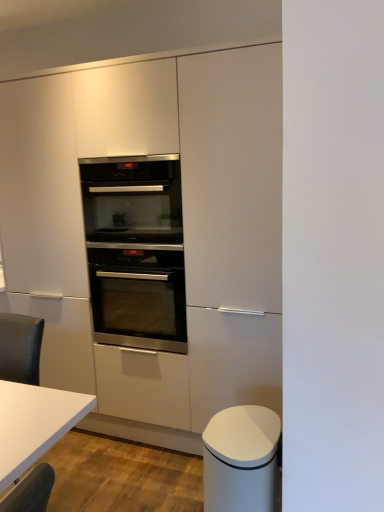
Question: Does white matte trash can at lower right, marked as the 2th cabinetry in a back-to-front arrangement, appear on the left side of stainless steel oven at center, which ranks as the second oven in bottom-to-top order?

Choices:
 (A) yes
 (B) no

Answer: (B)

Question: Does white matte trash can at lower right, marked as the 2th cabinetry in a back-to-front arrangement, come in front of stainless steel oven at center, which ranks as the second oven in bottom-to-top order?

Choices:
 (A) no
 (B) yes

Answer: (B)

Question: Is white matte trash can at lower right, the first cabinetry from the front, oriented towards stainless steel oven at center, which ranks as the second oven in bottom-to-top order?

Choices:
 (A) yes
 (B) no

Answer: (B)

Question: Considering the relative sizes of white matte trash can at lower right, marked as the 2th cabinetry in a back-to-front arrangement, and stainless steel oven at center, which appears as the first oven when viewed from the top, in the image provided, is white matte trash can at lower right, marked as the 2th cabinetry in a back-to-front arrangement, taller than stainless steel oven at center, which appears as the first oven when viewed from the top,?

Choices:
 (A) no
 (B) yes

Answer: (B)

Question: Considering the relative sizes of white matte trash can at lower right, marked as the 2th cabinetry in a back-to-front arrangement, and stainless steel oven at center, which ranks as the second oven in bottom-to-top order, in the image provided, is white matte trash can at lower right, marked as the 2th cabinetry in a back-to-front arrangement, smaller than stainless steel oven at center, which ranks as the second oven in bottom-to-top order,?

Choices:
 (A) no
 (B) yes

Answer: (B)

Question: Is white matte trash can at lower right, the first cabinetry from the front, positioned far away from stainless steel oven at center, which ranks as the second oven in bottom-to-top order?

Choices:
 (A) yes
 (B) no

Answer: (A)

Question: From a real-world perspective, is white matte trash can at lower right, the first cabinetry from the front, located beneath white glossy table at lower left?

Choices:
 (A) yes
 (B) no

Answer: (A)

Question: Can you confirm if white matte trash can at lower right, the first cabinetry from the front, is thinner than white glossy table at lower left?

Choices:
 (A) yes
 (B) no

Answer: (B)

Question: Does white matte trash can at lower right, marked as the 2th cabinetry in a back-to-front arrangement, lie behind white glossy table at lower left?

Choices:
 (A) no
 (B) yes

Answer: (B)

Question: From the image's perspective, would you say white matte trash can at lower right, the first cabinetry from the front, is positioned over white glossy table at lower left?

Choices:
 (A) yes
 (B) no

Answer: (B)

Question: Can you confirm if white matte trash can at lower right, the first cabinetry from the front, is bigger than white glossy table at lower left?

Choices:
 (A) yes
 (B) no

Answer: (B)

Question: From the image's perspective, would you say white matte trash can at lower right, the first cabinetry from the front, is shown under white glossy table at lower left?

Choices:
 (A) yes
 (B) no

Answer: (A)

Question: Is white matte trash can at lower right, the first cabinetry from the front, inside satin white cabinet at center, the first cabinetry when ordered from back to front?

Choices:
 (A) no
 (B) yes

Answer: (A)